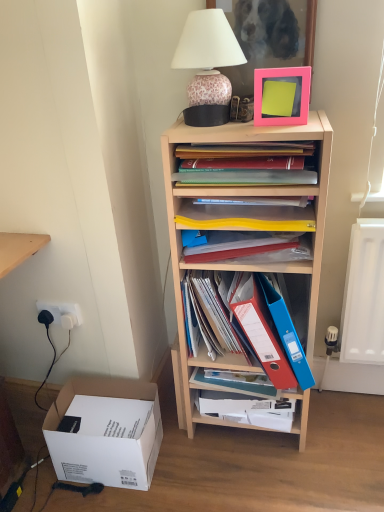
Locate an element on the screen. matte blue folder at center, which is the third book from top to bottom is located at coordinates (246, 409).

What is the approximate height of wooden shelf at center?

wooden shelf at center is 3.47 feet in height.

Describe the element at coordinates (213, 315) in the screenshot. I see `matte plastic folders at center, which is counted as the second book, starting from the top` at that location.

Identify the location of black plastic electric outlet at lower left. Image resolution: width=384 pixels, height=512 pixels. (48, 312).

What do you see at coordinates (48, 312) in the screenshot? I see `black plastic electric outlet at lower left` at bounding box center [48, 312].

What do you see at coordinates (243, 166) in the screenshot? I see `matte plastic folders at upper center, acting as the 3th book starting from the bottom` at bounding box center [243, 166].

Find the location of `white cardboard box at lower left`. white cardboard box at lower left is located at coordinates (105, 432).

Between black plastic electric outlet at lower left and matte plastic folder at center, the 2th paperback book viewed from the right, which one has smaller width?

With smaller width is black plastic electric outlet at lower left.

Consider the image. From the image's perspective, which is above, black plastic electric outlet at lower left or matte plastic folder at center, the 2th paperback book viewed from the right?

From the image's view, black plastic electric outlet at lower left is above.

Is black plastic electric outlet at lower left outside of matte plastic folder at center, which is counted as the 1th paperback book, starting from the left?

black plastic electric outlet at lower left is positioned outside matte plastic folder at center, which is counted as the 1th paperback book, starting from the left.

From a real-world perspective, is matte blue folder at center, which is the third book from top to bottom, under matte plastic folders at center, positioned as the 2th book in bottom-to-top order?

Yes.

Between matte blue folder at center, which is the third book from top to bottom, and matte plastic folders at center, positioned as the 2th book in bottom-to-top order, which one appears on the right side from the viewer's perspective?

matte blue folder at center, which is the third book from top to bottom, is more to the right.

Is point (218, 416) closer to camera compared to point (191, 289)?

No, it is not.

Which of these two, matte blue folder at center, which is the third book from top to bottom, or matte plastic folders at center, positioned as the 2th book in bottom-to-top order, is wider?

matte blue folder at center, which is the third book from top to bottom.

Locate an element on the screen. lamp in front of the matte plastic folders at center, which is counted as the second book, starting from the top is located at coordinates (208, 66).

Is leopard print ceramic lamp at upper center in front of matte plastic folders at center, positioned as the 2th book in bottom-to-top order?

Yes, it is.

Considering the sizes of objects leopard print ceramic lamp at upper center and matte plastic folders at center, positioned as the 2th book in bottom-to-top order, in the image provided, who is thinner, leopard print ceramic lamp at upper center or matte plastic folders at center, positioned as the 2th book in bottom-to-top order,?

With smaller width is matte plastic folders at center, positioned as the 2th book in bottom-to-top order.

From the image's perspective, would you say leopard print ceramic lamp at upper center is shown under matte plastic folders at center, which is counted as the second book, starting from the top?

No, from the image's perspective, leopard print ceramic lamp at upper center is not beneath matte plastic folders at center, which is counted as the second book, starting from the top.

Is yellow plastic magazine at center in contact with wooden shelf at center?

No, yellow plastic magazine at center is not touching wooden shelf at center.

Considering the positions of point (299, 234) and point (324, 138), is point (299, 234) closer or farther from the camera than point (324, 138)?

Clearly, point (299, 234) is more distant from the camera than point (324, 138).

Does yellow plastic magazine at center have a lesser width compared to wooden shelf at center?

Correct, the width of yellow plastic magazine at center is less than that of wooden shelf at center.

Considering the sizes of yellow plastic magazine at center and wooden shelf at center in the image, is yellow plastic magazine at center taller or shorter than wooden shelf at center?

In the image, yellow plastic magazine at center appears to be shorter than wooden shelf at center.

Is leopard print ceramic lamp at upper center aimed at white plastic power outlet at lower left?

No, leopard print ceramic lamp at upper center is not turned towards white plastic power outlet at lower left.

Can you see leopard print ceramic lamp at upper center touching white plastic power outlet at lower left?

No, leopard print ceramic lamp at upper center is not making contact with white plastic power outlet at lower left.

Which is correct: leopard print ceramic lamp at upper center is inside white plastic power outlet at lower left, or outside of it?

leopard print ceramic lamp at upper center is not inside white plastic power outlet at lower left, it's outside.

How many degrees apart are the facing directions of leopard print ceramic lamp at upper center and white plastic power outlet at lower left?

leopard print ceramic lamp at upper center and white plastic power outlet at lower left are facing 2.8 degrees away from each other.

Is blue plastic folder at center right, positioned as the second paperback book in left-to-right order, positioned with its back to matte plastic folder at center, the 2th paperback book viewed from the right?

Yes, blue plastic folder at center right, positioned as the second paperback book in left-to-right order,'s orientation is away from matte plastic folder at center, the 2th paperback book viewed from the right.

Considering the relative sizes of blue plastic folder at center right, positioned as the second paperback book in left-to-right order, and matte plastic folder at center, the 2th paperback book viewed from the right, in the image provided, is blue plastic folder at center right, positioned as the second paperback book in left-to-right order, bigger than matte plastic folder at center, the 2th paperback book viewed from the right,?

Incorrect, blue plastic folder at center right, positioned as the second paperback book in left-to-right order, is not larger than matte plastic folder at center, the 2th paperback book viewed from the right.

Does point (304, 165) lie behind point (255, 295)?

No.

Is matte plastic folders at upper center, acting as the 3th book starting from the bottom, completely or partially outside of matte plastic folder at center, which is counted as the 1th paperback book, starting from the left?

Yes, matte plastic folders at upper center, acting as the 3th book starting from the bottom, is outside of matte plastic folder at center, which is counted as the 1th paperback book, starting from the left.

Does matte plastic folders at upper center, which is the first book from top to bottom, have a greater width compared to matte plastic folder at center, which is counted as the 1th paperback book, starting from the left?

No.

Is matte plastic folders at upper center, which is the first book from top to bottom, at the right side of matte plastic folder at center, which is counted as the 1th paperback book, starting from the left?

No.

At what (x,y) coordinates should I click in order to perform the action: click on electric outlet located behind the matte plastic folder at center, the 2th paperback book viewed from the right. Please return your answer as a coordinate pair (x, y). This screenshot has height=512, width=384. Looking at the image, I should click on (48, 312).

Identify the location of the 1st book in front of the matte blue folder at center, marked as the 1th book in a bottom-to-top arrangement, counting from the anchor's position. The height and width of the screenshot is (512, 384). (213, 315).

Considering their positions, is pink matte picture frame at upper center, acting as the 1th picture frame starting from the bottom, positioned closer to blue plastic folder at center right, positioned as the second paperback book in left-to-right order, than leopard print ceramic lamp at upper center?

Among the two, pink matte picture frame at upper center, acting as the 1th picture frame starting from the bottom, is located nearer to blue plastic folder at center right, positioned as the second paperback book in left-to-right order.

Based on their spatial positions, is leopard print ceramic lamp at upper center or pink matte picture frame at upper center, marked as the second picture frame in a top-to-bottom arrangement, further from blue plastic folder at center right, the first paperback book in the right-to-left sequence?

leopard print ceramic lamp at upper center is further to blue plastic folder at center right, the first paperback book in the right-to-left sequence.

From the image, which object appears to be nearer to wooden shelf at center, leopard print ceramic lamp at upper center or pink matte picture frame at upper center, acting as the 1th picture frame starting from the bottom?

leopard print ceramic lamp at upper center is closer to wooden shelf at center.

From the image, which object appears to be farther from leopard print ceramic lamp at upper center, matte plastic folders at center, positioned as the 2th book in bottom-to-top order, or wooden shelf at center?

Among the two, matte plastic folders at center, positioned as the 2th book in bottom-to-top order, is located further to leopard print ceramic lamp at upper center.

When comparing their distances from pink matte picture frame at upper center, acting as the 1th picture frame starting from the bottom, does matte plastic folders at center, which is counted as the second book, starting from the top, or leopard print ceramic lamp at upper center seem further?

The object further to pink matte picture frame at upper center, acting as the 1th picture frame starting from the bottom, is matte plastic folders at center, which is counted as the second book, starting from the top.

From the image, which object appears to be farther from white plastic power outlet at lower left, matte plastic folders at center, which is counted as the second book, starting from the top, or white cardboard box at lower left?

matte plastic folders at center, which is counted as the second book, starting from the top.

Estimate the real-world distances between objects in this image. Which object is further from white plastic power outlet at lower left, matte blue folder at center, which is the third book from top to bottom, or yellow plastic magazine at center?

Based on the image, matte blue folder at center, which is the third book from top to bottom, appears to be further to white plastic power outlet at lower left.

When comparing their distances from black plastic electric outlet at lower left, does white plastic power outlet at lower left or matte plastic folders at upper center, acting as the 3th book starting from the bottom, seem further?

matte plastic folders at upper center, acting as the 3th book starting from the bottom, lies further to black plastic electric outlet at lower left than the other object.

Locate an element on the screen. magazine between pink matte picture frame at upper center, acting as the 1th picture frame starting from the bottom, and matte blue folder at center, which is the third book from top to bottom, in the vertical direction is located at coordinates 245,245.

The image size is (384, 512). What are the coordinates of `shelf between leopard print ceramic lamp at upper center and white plastic power outlet at lower left in the vertical direction` in the screenshot? It's located at (246, 230).

At what (x,y) coordinates should I click in order to perform the action: click on box located between black plastic electric outlet at lower left and matte blue folder at center, marked as the 1th book in a bottom-to-top arrangement, in the left-right direction. Please return your answer as a coordinate pair (x, y). The width and height of the screenshot is (384, 512). Looking at the image, I should click on point(105,432).

Find the location of a particular element. This screenshot has width=384, height=512. electric outlet between pink matte picture frame at upper center, arranged as the 1th picture frame when viewed from the top, and white cardboard box at lower left vertically is located at coordinates (48, 312).